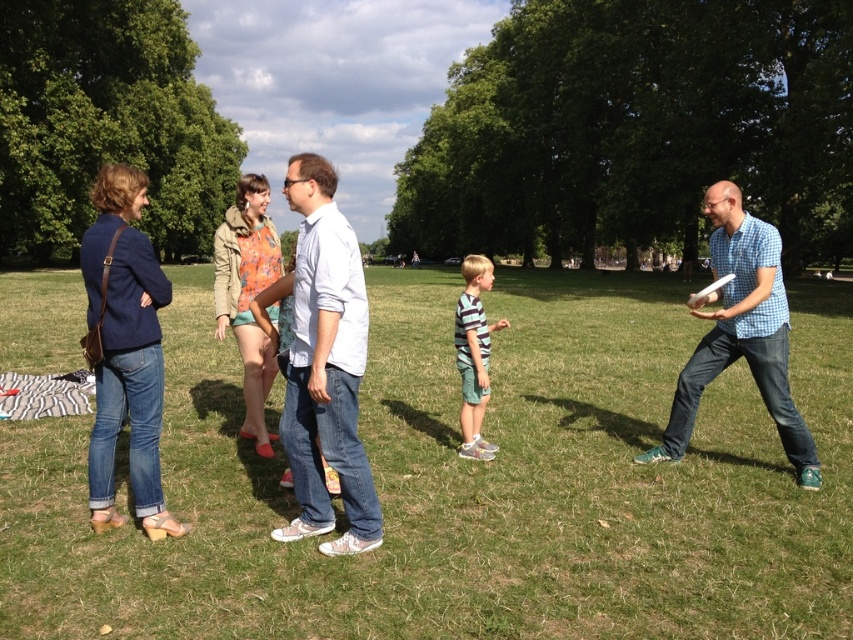
What is the location of the point at coordinates (467, 483) in the image?

The point at coordinates (467, 483) is located on the green grassy field at center.

Based on the scene description, where is the light blue cotton shirt at center located in the image?

The light blue cotton shirt at center is located at the coordinates point [326,365].